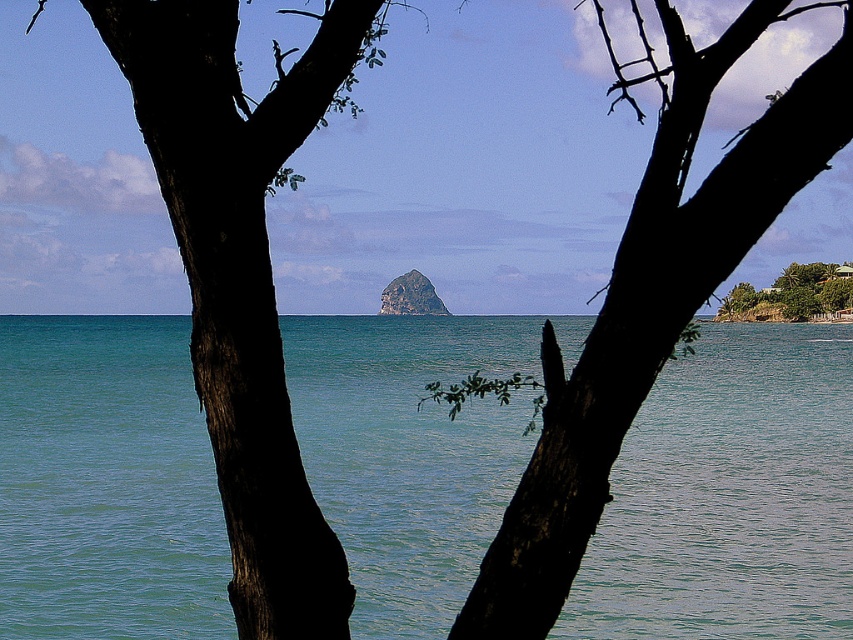
Question: Is clear blue water at center above green leafy tree at right?

Choices:
 (A) yes
 (B) no

Answer: (B)

Question: Which of the following is the closest to the observer?

Choices:
 (A) clear blue water at center
 (B) dark bark tree at center
 (C) green leafy tree at right

Answer: (B)

Question: Is clear blue water at center to the left of dark bark tree at center from the viewer's perspective?

Choices:
 (A) yes
 (B) no

Answer: (A)

Question: Does clear blue water at center appear on the right side of green leafy tree at right?

Choices:
 (A) yes
 (B) no

Answer: (B)

Question: Which object appears farthest from the camera in this image?

Choices:
 (A) green mossy rock at center
 (B) clear blue water at center
 (C) green leafy tree at right
 (D) dark bark tree at center

Answer: (A)

Question: Which point appears farthest from the camera in this image?

Choices:
 (A) (x=560, y=516)
 (B) (x=47, y=570)
 (C) (x=735, y=314)
 (D) (x=397, y=314)

Answer: (D)